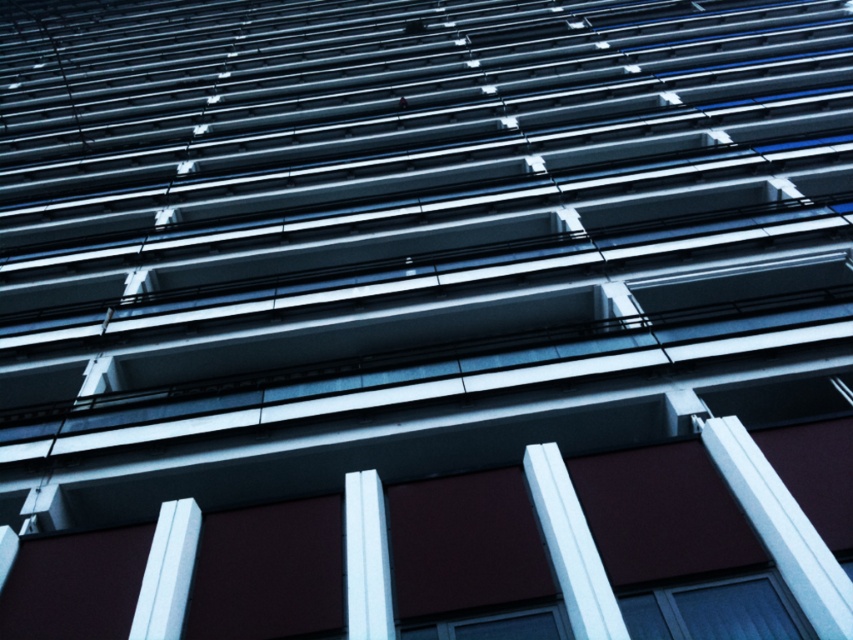
Consider the image. Is white smooth pillar at lower center below white glossy pillar at center?

Incorrect, white smooth pillar at lower center is not positioned below white glossy pillar at center.

Can you confirm if white smooth pillar at lower center is positioned to the left of white glossy pillar at center?

In fact, white smooth pillar at lower center is to the right of white glossy pillar at center.

Between point (604, 620) and point (387, 636), which one is positioned in front?

Point (604, 620) is more forward.

This screenshot has width=853, height=640. I want to click on white smooth pillar at lower center, so click(x=572, y=547).